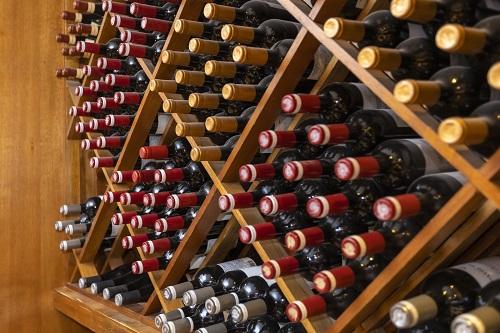
The width and height of the screenshot is (500, 333). Identify the location of wine bottles on the bottom left. (88, 283), (95, 287), (105, 291), (118, 298).